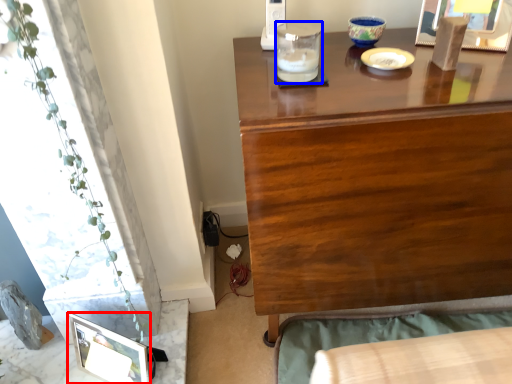
Question: Which object is closer to the camera taking this photo, picture frame (highlighted by a red box) or candle holder (highlighted by a blue box)?

Choices:
 (A) picture frame
 (B) candle holder

Answer: (B)